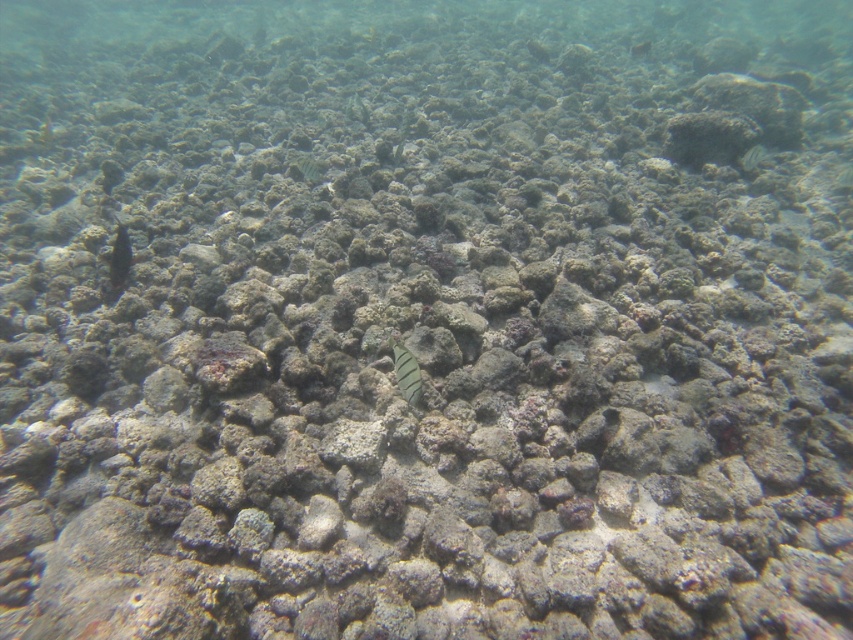
You are a marine biologist diving in the underwater scene described. Your diving gear has a 1.5 meter reach tool. You spot the gray striped fish at center. Can you safely reach it with your tool?

The gray striped fish at center is 1.55 meters away from the viewer. Since the tool has a 1.5 meter reach, it is slightly shorter than the required distance, so you cannot safely reach the fish with the tool.

You are a marine biologist observing this underwater scene. You need to determine which fish is closer to you. Which one is nearer between the gray striped fish at center and the speckled green fish at upper right?

The gray striped fish at center is closer to the viewer than the speckled green fish at upper right according to the description.